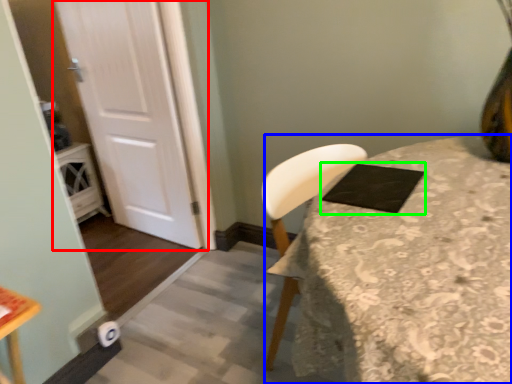
Question: Which object is the closest to the door (highlighted by a red box)? Choose among these: table (highlighted by a blue box) or pad (highlighted by a green box).

Choices:
 (A) table
 (B) pad

Answer: (B)